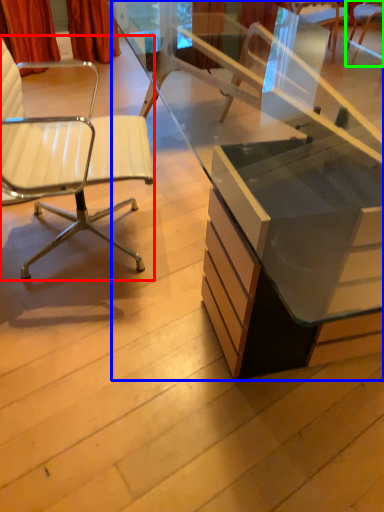
Question: Which object is positioned farthest from chair (highlighted by a red box)? Select from desk (highlighted by a blue box) and chair (highlighted by a green box).

Choices:
 (A) desk
 (B) chair

Answer: (B)